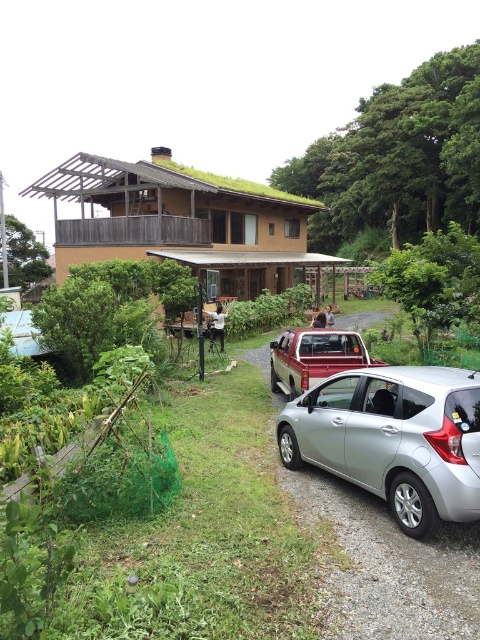
How much distance is there between metallic silver car at lower center and silver metallic sedan at center?

4.30 feet

Which of these two, metallic silver car at lower center or silver metallic sedan at center, stands taller?

With more height is silver metallic sedan at center.

Does point (450, 552) come farther from viewer compared to point (283, 362)?

No.

Where is `metallic silver car at lower center`? The height and width of the screenshot is (640, 480). metallic silver car at lower center is located at coordinates point(389,566).

Measure the distance from silver metallic car at lower right to metallic silver car at lower center.

They are 33.75 inches apart.

Is silver metallic car at lower right above metallic silver car at lower center?

Yes, silver metallic car at lower right is above metallic silver car at lower center.

Between point (453, 506) and point (463, 545), which one is positioned in front?

Positioned in front is point (453, 506).

Where is `silver metallic car at lower right`? silver metallic car at lower right is located at coordinates point(394,440).

You are a GUI agent. You are given a task and a screenshot of the screen. Output one action in this format:
    pyautogui.click(x=<x>, y=<y>)
    Task: Click on the silver metallic car at lower right
    The height and width of the screenshot is (640, 480).
    Given the screenshot: What is the action you would take?
    click(x=394, y=440)

From the picture: Who is more forward, (333, 461) or (297, 364)?

Point (333, 461) is more forward.

The image size is (480, 640). Find the location of `silver metallic car at lower right`. silver metallic car at lower right is located at coordinates (394, 440).